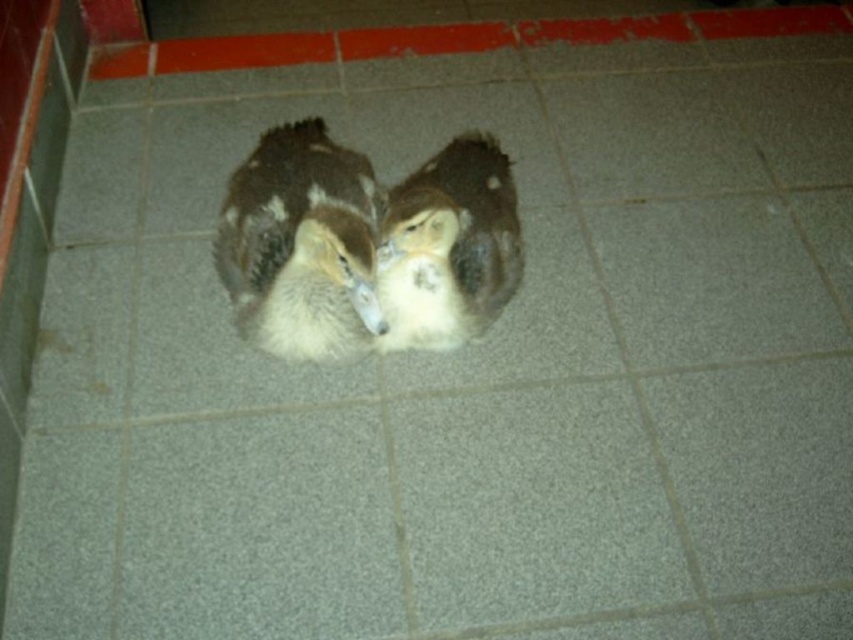
You are a photographer trying to capture a clear photo of the brown fuzzy duck at center and the white fluffy duck at center. Since they are both at the center, which duck is blocking the other one from view?

The brown fuzzy duck at center is positioned under the white fluffy duck at center, so the white fluffy duck at center is blocking the view of the brown fuzzy duck at center.

You are a photographer trying to capture the ducklings in the image. You want to ensure that both the brown fuzzy duck at center and the white fluffy duck at center are in focus. Since your camera can only focus on one duckling at a time, which duckling should you focus on to ensure the other is also in focus due to their size difference?

The brown fuzzy duck at center is taller than the white fluffy duck at center. By focusing on the taller brown fuzzy duck at center, the shorter white fluffy duck at center will also be within the depth of field, ensuring both are in focus.